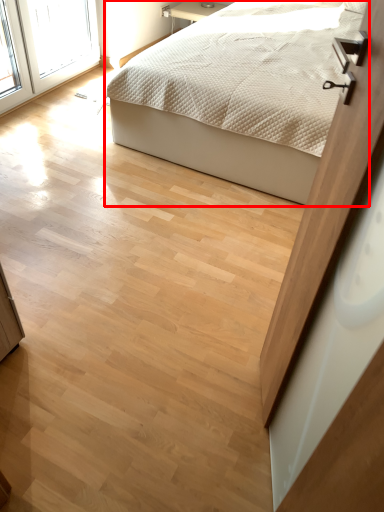
Question: In this image, where is bed (annotated by the red box) located relative to screen door?

Choices:
 (A) left
 (B) right

Answer: (B)